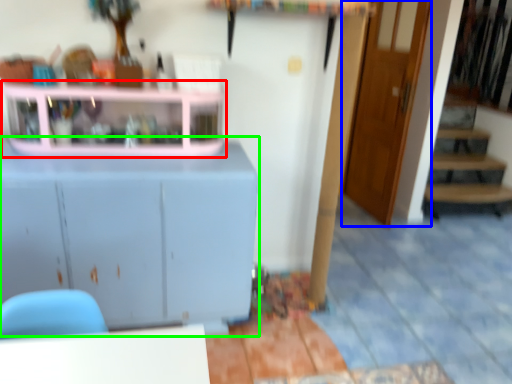
Question: Which object is positioned farthest from shelf (highlighted by a red box)? Select from door (highlighted by a blue box) and cabinetry (highlighted by a green box).

Choices:
 (A) door
 (B) cabinetry

Answer: (A)